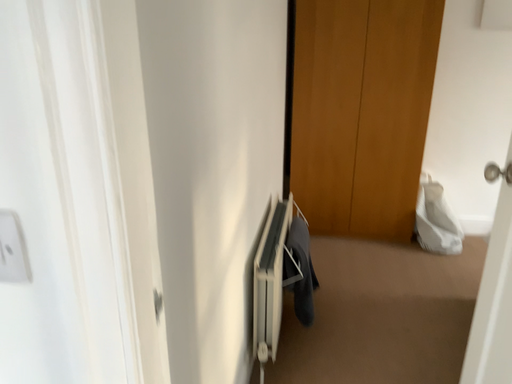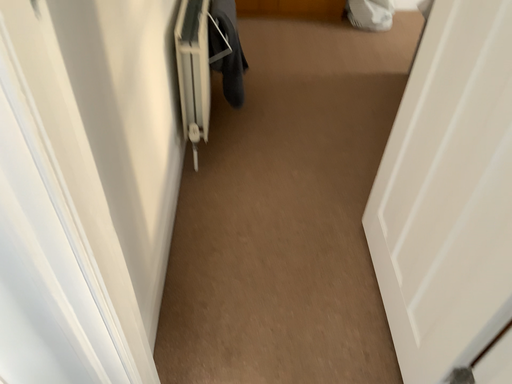
Question: Which way did the camera rotate in the video?

Choices:
 (A) rotated left
 (B) rotated right

Answer: (B)